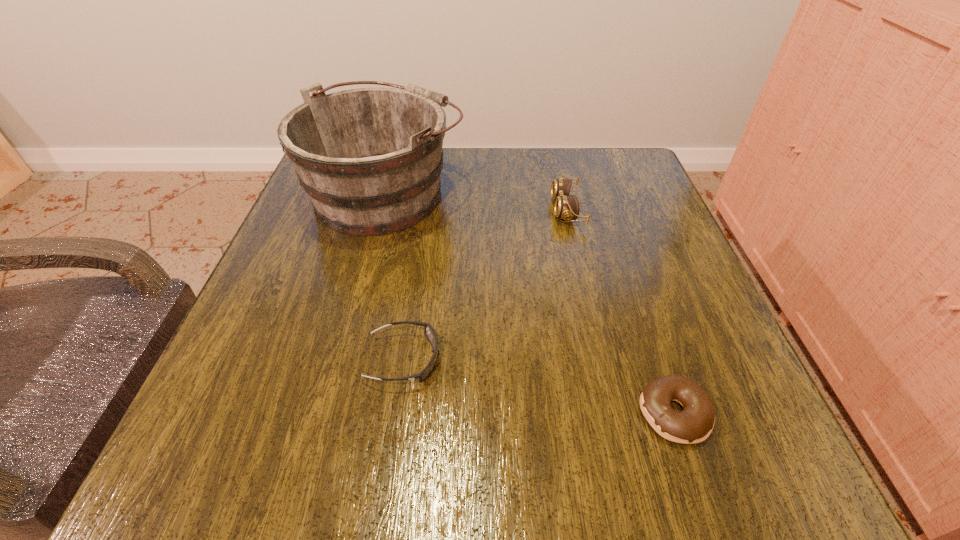
At what (x,y) coordinates should I click in order to perform the action: click on free space at the near edge. Please return your answer as a coordinate pair (x, y). The height and width of the screenshot is (540, 960). Looking at the image, I should click on (609, 425).

Locate an element on the screen. This screenshot has width=960, height=540. vacant space at the left edge of the desktop is located at coordinates (264, 287).

You are a GUI agent. You are given a task and a screenshot of the screen. Output one action in this format:
    pyautogui.click(x=<x>, y=<y>)
    Task: Click on the vacant area at the right edge of the desktop
    Image resolution: width=960 pixels, height=540 pixels.
    Given the screenshot: What is the action you would take?
    pyautogui.click(x=722, y=349)

This screenshot has height=540, width=960. In the image, there is a desktop. In order to click on vacant area at the near left corner in this screenshot , I will do `click(187, 488)`.

Identify the location of vacant space at the far right corner of the desktop. This screenshot has height=540, width=960. (629, 191).

This screenshot has width=960, height=540. I want to click on vacant space at the near right corner of the desktop, so click(706, 458).

Where is `free spot between the shorter goggles and the wine bucket`? This screenshot has height=540, width=960. free spot between the shorter goggles and the wine bucket is located at coordinates (395, 275).

Locate an element on the screen. This screenshot has height=540, width=960. free spot between the left goggles and the rightmost object is located at coordinates (539, 386).

This screenshot has height=540, width=960. Find the location of `empty space that is in between the wine bucket and the doughnut`. empty space that is in between the wine bucket and the doughnut is located at coordinates (530, 302).

The width and height of the screenshot is (960, 540). Identify the location of empty space between the tallest object and the left goggles. (395, 275).